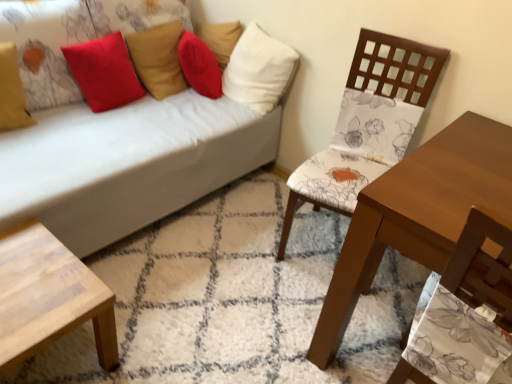
Question: Would you say matte yellow pillow at upper left, acting as the 1th pillow starting from the left, is part of floral fabric chair at center right's contents?

Choices:
 (A) yes
 (B) no

Answer: (B)

Question: Considering the relative positions of floral fabric chair at center right and matte yellow pillow at upper left, the fourth pillow viewed from the right, in the image provided, is floral fabric chair at center right to the left of matte yellow pillow at upper left, the fourth pillow viewed from the right, from the viewer's perspective?

Choices:
 (A) yes
 (B) no

Answer: (B)

Question: Is the position of floral fabric chair at center right more distant than that of matte yellow pillow at upper left, acting as the 1th pillow starting from the left?

Choices:
 (A) yes
 (B) no

Answer: (B)

Question: Does floral fabric chair at center right have a lesser width compared to matte yellow pillow at upper left, the fourth pillow viewed from the right?

Choices:
 (A) no
 (B) yes

Answer: (A)

Question: Is floral fabric chair at center right positioned beyond the bounds of matte yellow pillow at upper left, the fourth pillow viewed from the right?

Choices:
 (A) yes
 (B) no

Answer: (A)

Question: From a real-world perspective, is floral fabric chair at center right over matte yellow pillow at upper left, acting as the 1th pillow starting from the left?

Choices:
 (A) no
 (B) yes

Answer: (A)

Question: Is matte yellow pillow at upper left, acting as the 1th pillow starting from the left, to the left of floral fabric chair at center right from the viewer's perspective?

Choices:
 (A) no
 (B) yes

Answer: (B)

Question: Does matte yellow pillow at upper left, acting as the 1th pillow starting from the left, have a lesser width compared to floral fabric chair at center right?

Choices:
 (A) no
 (B) yes

Answer: (B)

Question: From the image's perspective, is matte yellow pillow at upper left, the fourth pillow viewed from the right, over floral fabric chair at center right?

Choices:
 (A) yes
 (B) no

Answer: (A)

Question: Can you confirm if matte yellow pillow at upper left, acting as the 1th pillow starting from the left, is positioned to the right of floral fabric chair at center right?

Choices:
 (A) no
 (B) yes

Answer: (A)

Question: From the image's perspective, does matte yellow pillow at upper left, the fourth pillow viewed from the right, appear lower than floral fabric chair at center right?

Choices:
 (A) no
 (B) yes

Answer: (A)

Question: Is the position of matte yellow pillow at upper left, acting as the 1th pillow starting from the left, more distant than that of floral fabric chair at center right?

Choices:
 (A) no
 (B) yes

Answer: (B)

Question: Is floral fabric chair at center right further to camera compared to light wood/texture coffee table at lower left?

Choices:
 (A) yes
 (B) no

Answer: (A)